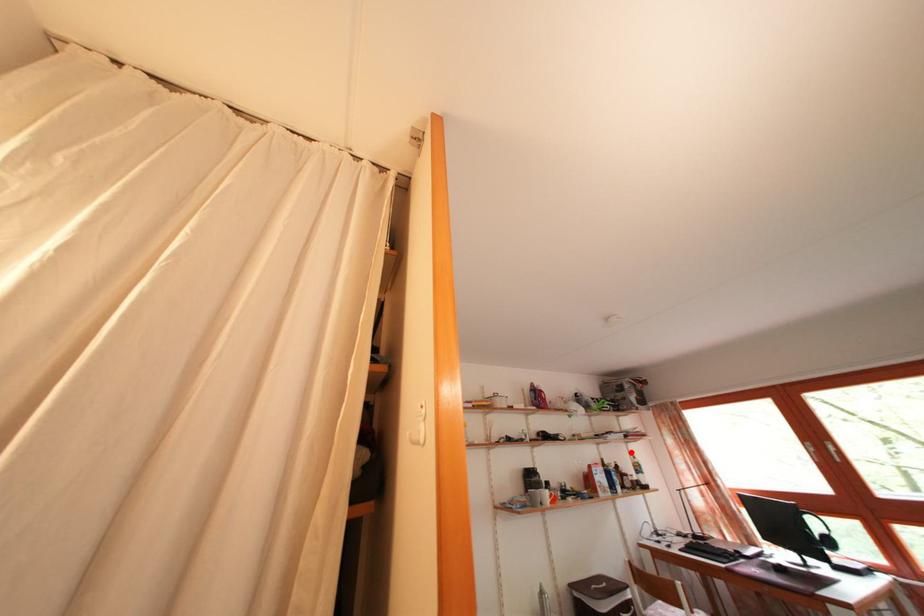
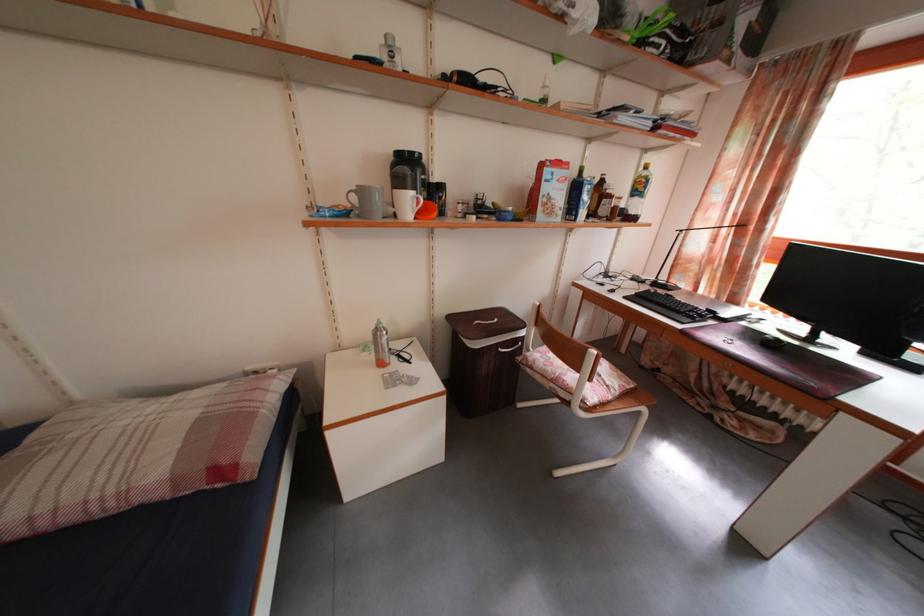
Question: A red point is marked in image1. In image2, is the corresponding 3D point closer to the camera or farther? Reply with the corresponding letter.

Choices:
 (A) The corresponding 3D point is closer.
 (B) The corresponding 3D point is farther.

Answer: (A)